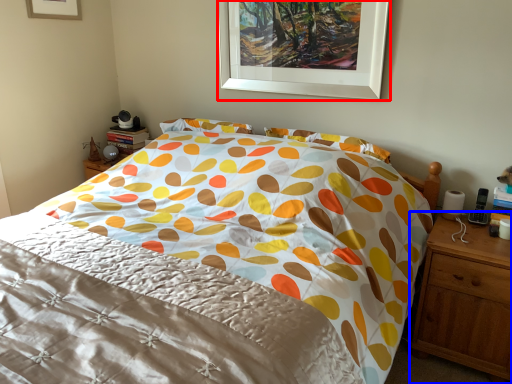
Question: Which object is further to the camera taking this photo, picture frame (highlighted by a red box) or nightstand (highlighted by a blue box)?

Choices:
 (A) picture frame
 (B) nightstand

Answer: (A)